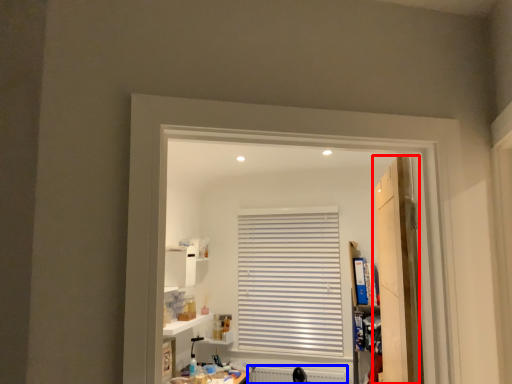
Question: Among these objects, which one is nearest to the camera, door (highlighted by a red box) or radiator (highlighted by a blue box)?

Choices:
 (A) door
 (B) radiator

Answer: (A)